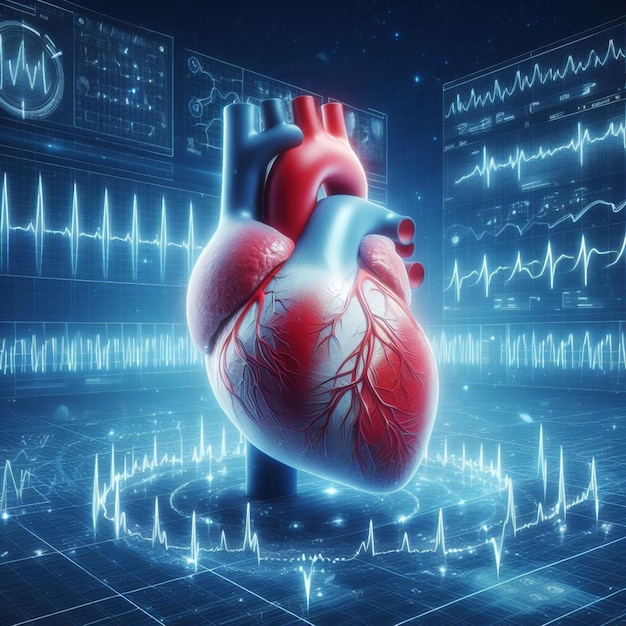
Find the location of a particular element. This screenshot has width=626, height=626. white and light gray grid floor is located at coordinates [138, 583].